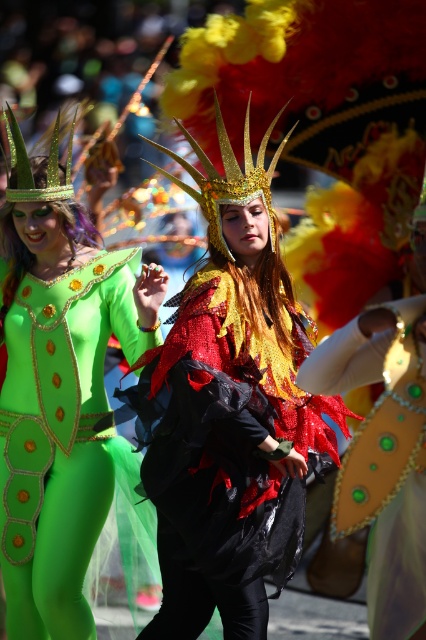
You are a photographer at the event and need to capture a photo that includes both the green matte bodysuit at left and the shiny gold mask at center. Based on their positions, which object should you focus on first to ensure both are in frame?

The green matte bodysuit at left is above the shiny gold mask at center, so you should focus on the shiny gold mask at center first to ensure both are in frame.

In the scene shown: You are a photographer at the parade, and you want to capture both the green matte bodysuit at left and the shiny gold mask at center in the same frame. Your camera has a maximum focus range of 8 feet. Can you fit both subjects within the camera frame without moving closer?

The green matte bodysuit at left and shiny gold mask at center are 7.87 feet apart. Since the distance between them is less than the camera maximum focus range of 8 feet, you can fit both subjects within the camera frame without moving closer.